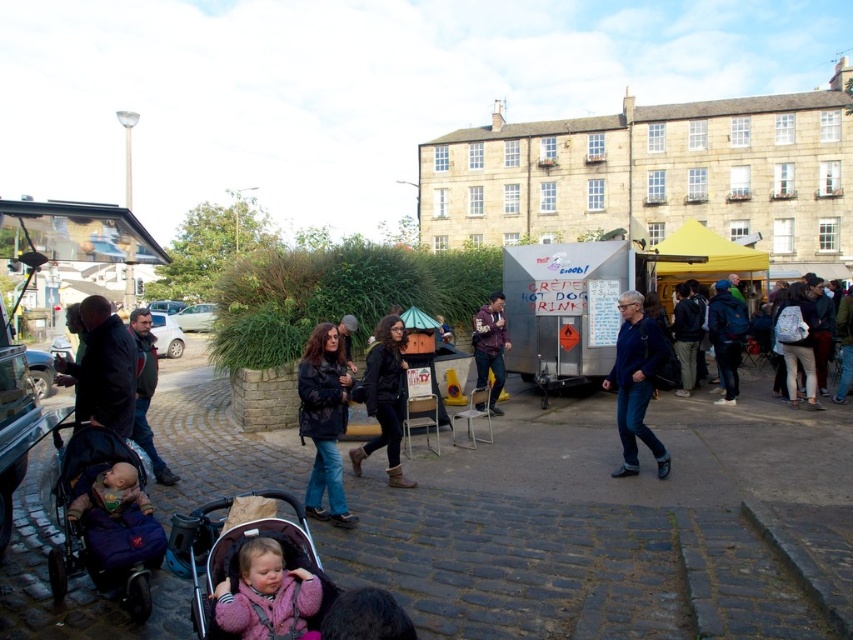
Question: Among these objects, which one is farthest from the camera?

Choices:
 (A) matte pink stroller at lower left
 (B) soft blue blanket at lower left
 (C) maroon fabric jacket at center

Answer: (C)

Question: Is dark blue jacket at center smaller than soft blue blanket at lower left?

Choices:
 (A) yes
 (B) no

Answer: (B)

Question: Which of the following is the farthest from the observer?

Choices:
 (A) dark blue jacket at center
 (B) matte pink stroller at lower left
 (C) matte black jacket at center

Answer: (C)

Question: Is silver metallic food truck at center wider than maroon fabric jacket at center?

Choices:
 (A) yes
 (B) no

Answer: (A)

Question: Is pink fleece jacket at lower center above dark blue backpack at center right?

Choices:
 (A) no
 (B) yes

Answer: (A)

Question: Which is nearer to the pink fleece jacket at lower center?

Choices:
 (A) silver metallic food truck at center
 (B) dark blue backpack at center right

Answer: (A)